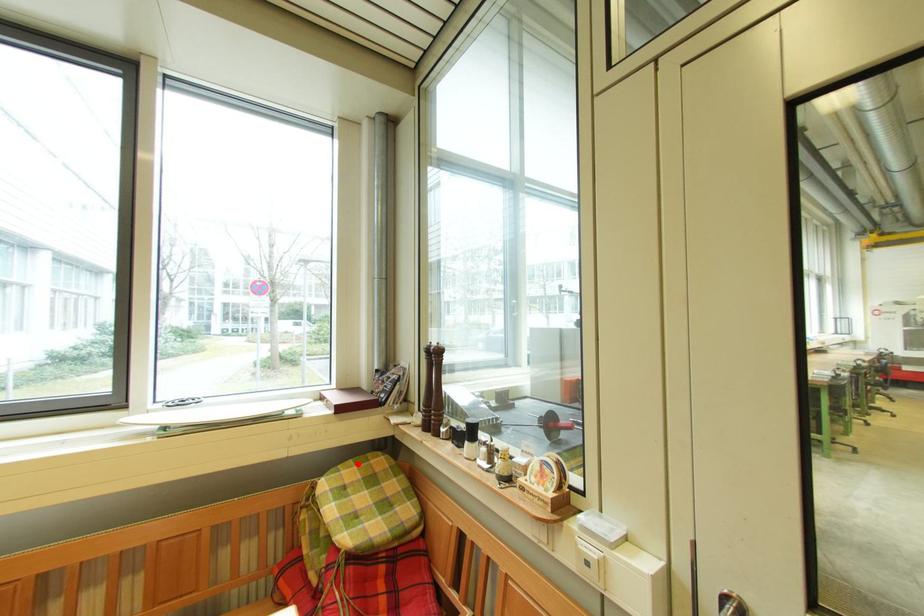
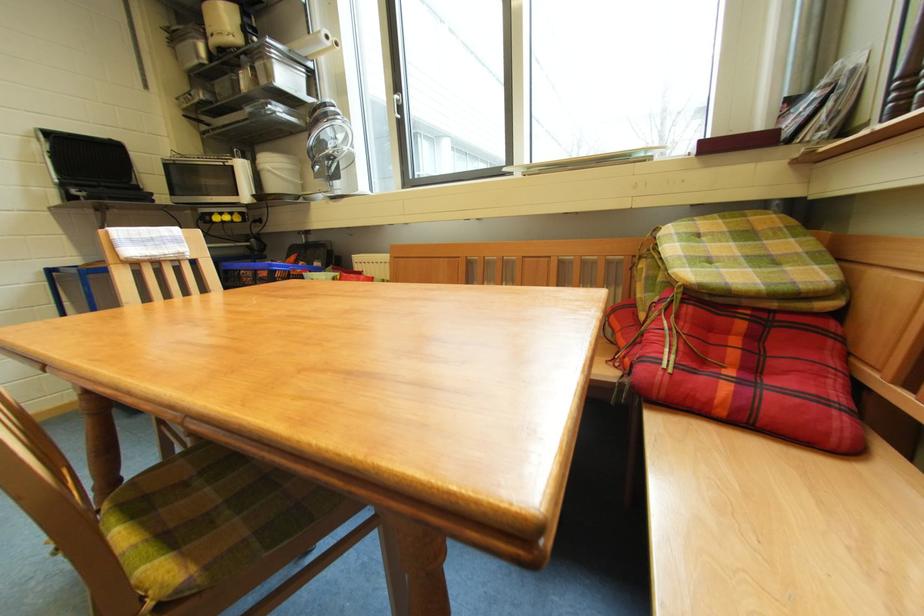
The point at the highlighted location is marked in the first image. Where is the corresponding point in the second image?

(723, 219)